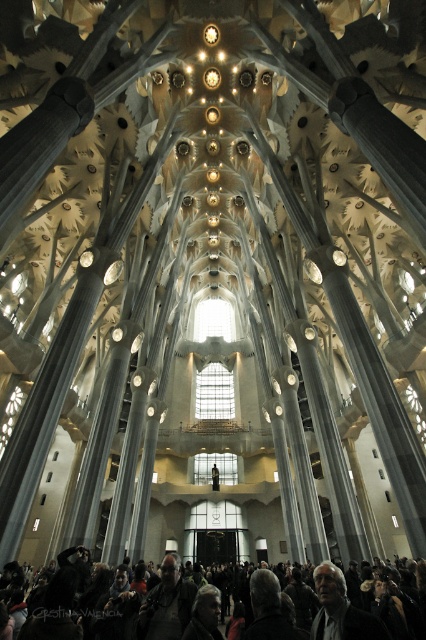
Question: Which point appears farthest from the camera in this image?

Choices:
 (A) (389, 588)
 (B) (160, 612)

Answer: (A)

Question: Is gray hair at center below dark gray jacket at lower center?

Choices:
 (A) no
 (B) yes

Answer: (A)

Question: Where is dark gray fabric crowd at lower center located in relation to gray hair at center in the image?

Choices:
 (A) left
 (B) right

Answer: (A)

Question: Which is nearer to the dark gray jacket at lower center?

Choices:
 (A) gray hair at center
 (B) dark gray fabric crowd at lower center

Answer: (B)

Question: Which point is closer to the camera taking this photo?

Choices:
 (A) (175, 577)
 (B) (327, 573)
 (C) (417, 628)

Answer: (C)

Question: Does dark gray fabric crowd at lower center have a lesser width compared to dark gray jacket at lower center?

Choices:
 (A) yes
 (B) no

Answer: (B)